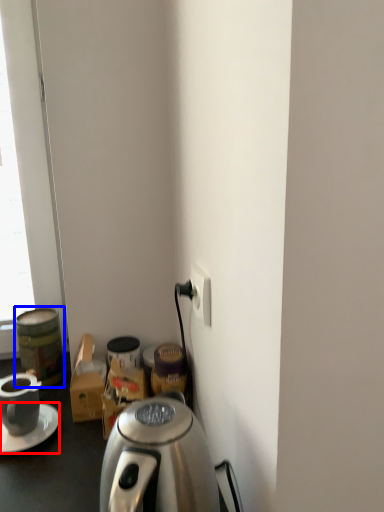
Question: Which object is closer to the camera taking this photo, saucer (highlighted by a red box) or beverage (highlighted by a blue box)?

Choices:
 (A) saucer
 (B) beverage

Answer: (A)